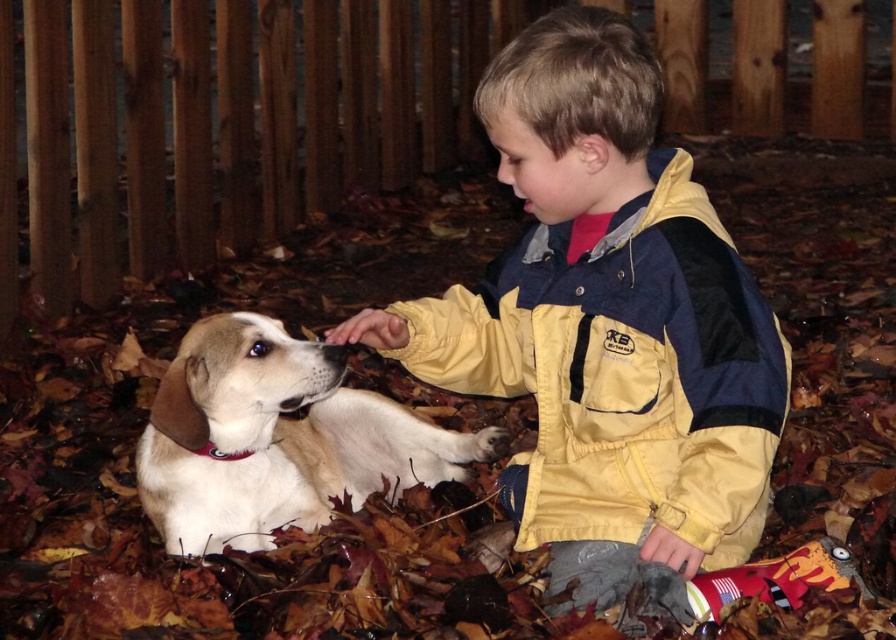
You are a photographer standing at the camera position. You want to capture a closeup of the yellow nylon jacket at center. Is the jacket within your camera lens range of 5 feet?

The yellow nylon jacket at center is 5.62 feet away from camera, so it is slightly out of the 5 feet range.

You are a photographer trying to capture the child and the dog in the image. Since the yellow nylon jacket at center and the white fur dog at center are both at the center, which one is closer to the camera?

The yellow nylon jacket at center is in front of the white fur dog at center, so the yellow nylon jacket at center is closer to the camera.